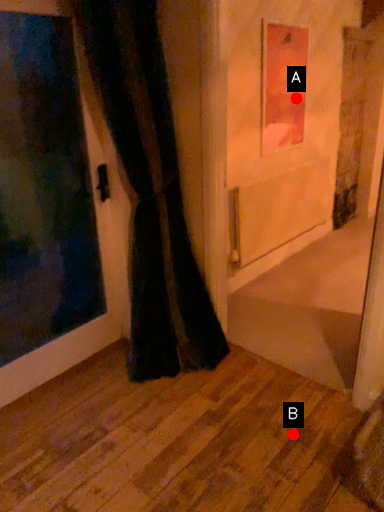
Question: Two points are circled on the image, labeled by A and B beside each circle. Which point appears farthest from the camera in this image?

Choices:
 (A) A is further
 (B) B is further

Answer: (A)